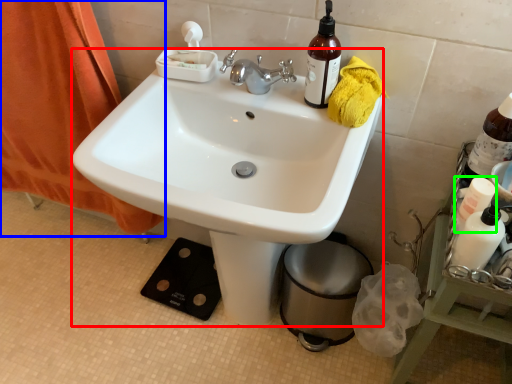
Question: Estimate the real-world distances between objects in this image. Which object is farther from sink (highlighted by a red box), curtain (highlighted by a blue box) or bottle (highlighted by a green box)?

Choices:
 (A) curtain
 (B) bottle

Answer: (B)